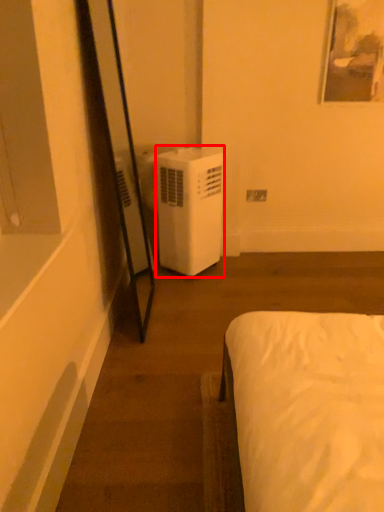
Question: Observing the image, what is the correct spatial positioning of air conditioner (annotated by the red box) in reference to electric outlet?

Choices:
 (A) left
 (B) right

Answer: (A)